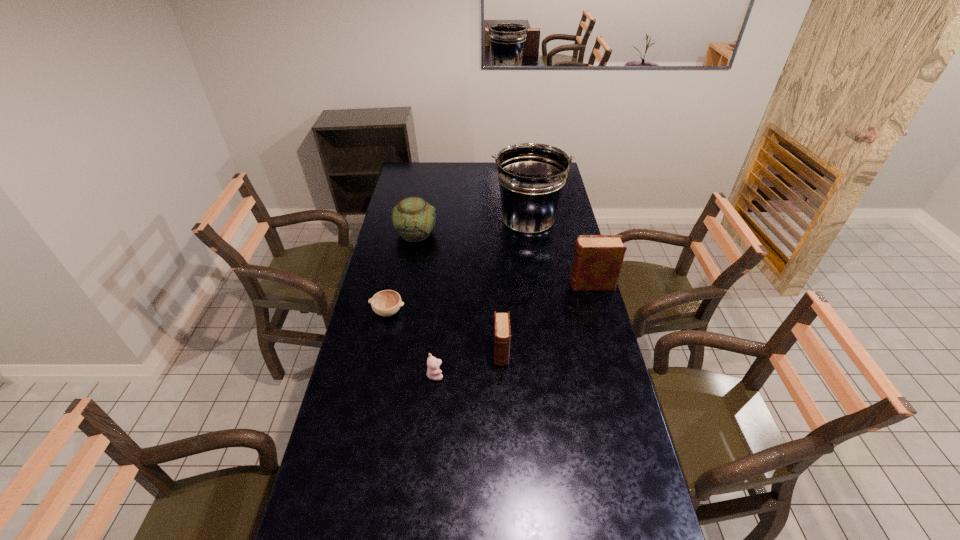
Locate an element on the screen. the nearer diary is located at coordinates (502, 333).

Locate an element on the screen. The width and height of the screenshot is (960, 540). the fifth farthest object is located at coordinates (502, 333).

Find the location of `the fifth shortest object`. the fifth shortest object is located at coordinates (597, 261).

The height and width of the screenshot is (540, 960). Find the location of `the right diary`. the right diary is located at coordinates (597, 261).

The width and height of the screenshot is (960, 540). Identify the location of pottery. (413, 218).

Where is `the tallest object`? The image size is (960, 540). the tallest object is located at coordinates (531, 176).

Identify the location of the third nearest object. (386, 303).

Image resolution: width=960 pixels, height=540 pixels. I want to click on bowl, so click(386, 303).

Identify the location of the second shortest object. The image size is (960, 540). (433, 372).

Where is `the third object from left to right`? the third object from left to right is located at coordinates (433, 372).